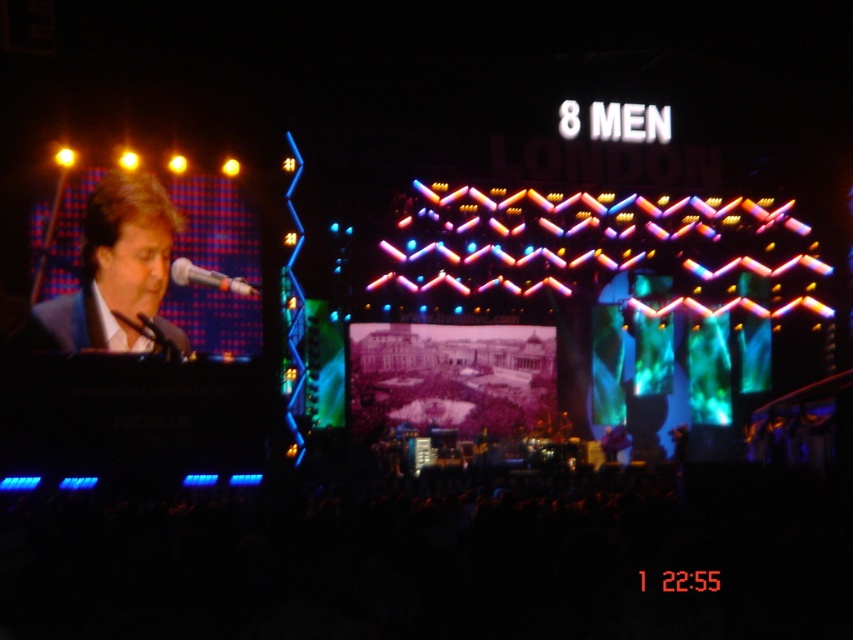
Does matte black suit at left appear over white glossy microphone at left?

Answer: Yes, matte black suit at left is above white glossy microphone at left.

Is matte black suit at left to the right of white glossy microphone at left from the viewer's perspective?

In fact, matte black suit at left is to the left of white glossy microphone at left.

The height and width of the screenshot is (640, 853). What do you see at coordinates (119, 269) in the screenshot?
I see `matte black suit at left` at bounding box center [119, 269].

Find the location of a particular element. This screenshot has width=853, height=640. matte black suit at left is located at coordinates (x=119, y=269).